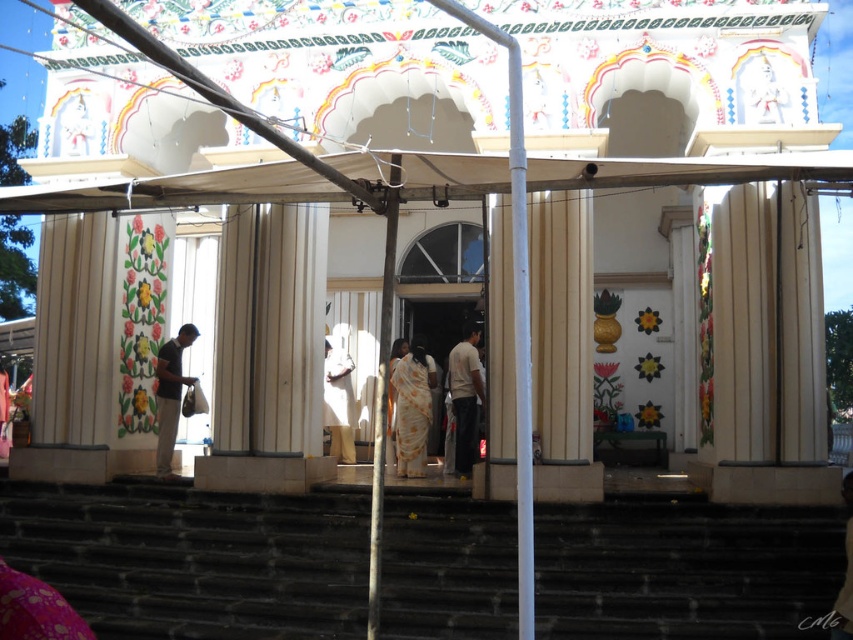
Does point (397, 429) come in front of point (163, 445)?

No.

Looking at this image, is white silk saree at center positioned in front of matte black shirt at left?

No, it is not.

Which is behind, point (422, 445) or point (157, 358)?

Point (157, 358)

The image size is (853, 640). I want to click on white silk saree at center, so click(x=410, y=406).

Can you confirm if dark stone stairs at lower center is shorter than white silk saree at center?

Yes, dark stone stairs at lower center is shorter than white silk saree at center.

Which is more to the left, dark stone stairs at lower center or white silk saree at center?

dark stone stairs at lower center

Who is more forward, (669, 525) or (422, 400)?

Positioned in front is point (669, 525).

I want to click on dark stone stairs at lower center, so click(x=194, y=557).

Which is more to the right, white fabric door at center or matte black shirt at left?

From the viewer's perspective, white fabric door at center appears more on the right side.

Describe the element at coordinates (439, 346) in the screenshot. I see `white fabric door at center` at that location.

Is point (428, 336) positioned before point (157, 372)?

No, it is not.

This screenshot has height=640, width=853. I want to click on white fabric door at center, so click(x=439, y=346).